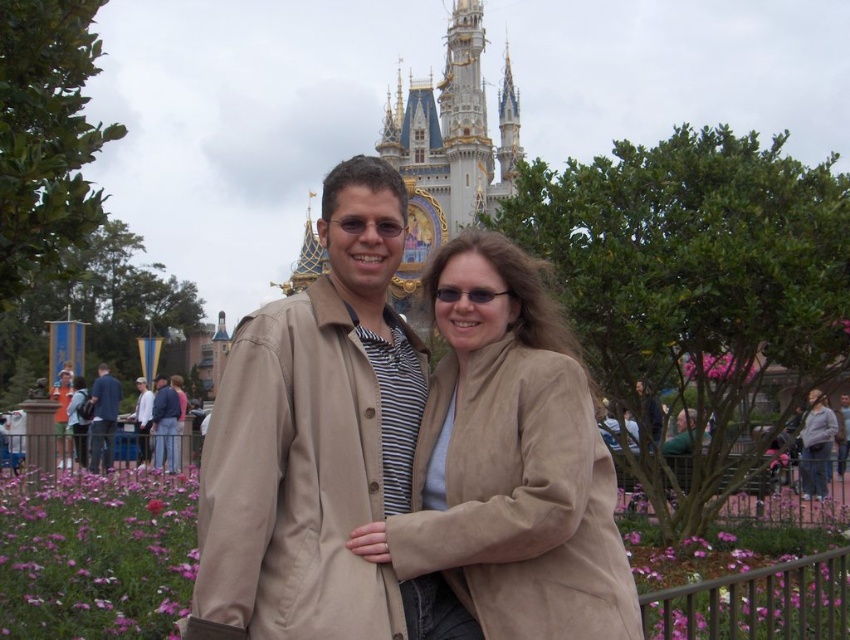
Question: Which point is closer to the camera?

Choices:
 (A) tan fabric coat at center
 (B) suede coat at center
 (C) white cotton shirt at center

Answer: (A)

Question: Which point appears closest to the camera in this image?

Choices:
 (A) (457, 397)
 (B) (409, 440)
 (C) (174, 470)

Answer: (B)

Question: Can you confirm if tan fabric coat at center is bigger than suede coat at center?

Choices:
 (A) no
 (B) yes

Answer: (B)

Question: Is blue denim jeans at center further to camera compared to white cotton shirt at center?

Choices:
 (A) yes
 (B) no

Answer: (B)

Question: Which object is farther from the camera taking this photo?

Choices:
 (A) tan fabric coat at center
 (B) white cotton shirt at center
 (C) suede coat at center

Answer: (B)

Question: From the image, what is the correct spatial relationship of dark blue jeans at center in relation to blue denim jeans at center?

Choices:
 (A) above
 (B) below

Answer: (A)